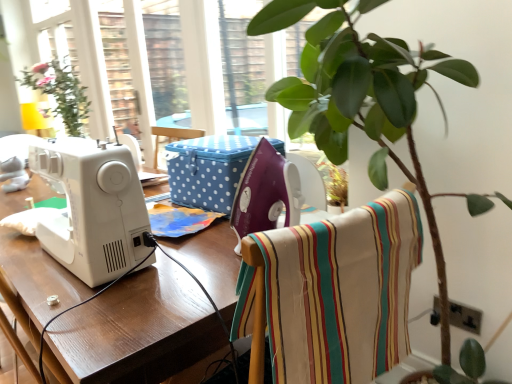
Question: Does white glossy sewing machine at left contain blue polka dot fabric box at center?

Choices:
 (A) no
 (B) yes

Answer: (A)

Question: Is white glossy sewing machine at left wider than blue polka dot fabric box at center?

Choices:
 (A) no
 (B) yes

Answer: (B)

Question: Does white glossy sewing machine at left appear on the left side of blue polka dot fabric box at center?

Choices:
 (A) no
 (B) yes

Answer: (B)

Question: From a real-world perspective, does white glossy sewing machine at left stand above blue polka dot fabric box at center?

Choices:
 (A) yes
 (B) no

Answer: (B)

Question: From the image's perspective, would you say white glossy sewing machine at left is shown under blue polka dot fabric box at center?

Choices:
 (A) no
 (B) yes

Answer: (B)

Question: From a real-world perspective, is white glossy sewing machine at left positioned above or below white plastic sewing machine at center, placed as the first sewing machine when sorted from right to left?

Choices:
 (A) below
 (B) above

Answer: (A)

Question: Is white glossy sewing machine at left taller or shorter than white plastic sewing machine at center, placed as the first sewing machine when sorted from right to left?

Choices:
 (A) tall
 (B) short

Answer: (A)

Question: Based on their sizes in the image, would you say white glossy sewing machine at left is bigger or smaller than white plastic sewing machine at center, placed as the first sewing machine when sorted from right to left?

Choices:
 (A) big
 (B) small

Answer: (A)

Question: From the image's perspective, is white glossy sewing machine at left above or below white plastic sewing machine at center, placed as the first sewing machine when sorted from right to left?

Choices:
 (A) below
 (B) above

Answer: (A)

Question: Considering the positions of striped cotton fabric at center and white glossy sewing machine at left in the image, is striped cotton fabric at center taller or shorter than white glossy sewing machine at left?

Choices:
 (A) short
 (B) tall

Answer: (A)

Question: Based on their positions, is striped cotton fabric at center located to the left or right of white glossy sewing machine at left?

Choices:
 (A) left
 (B) right

Answer: (B)

Question: Considering the positions of point coord(303,326) and point coord(4,241), is point coord(303,326) closer or farther from the camera than point coord(4,241)?

Choices:
 (A) farther
 (B) closer

Answer: (B)

Question: From a real-world perspective, is striped cotton fabric at center above or below white glossy sewing machine at left?

Choices:
 (A) below
 (B) above

Answer: (B)

Question: From a real-world perspective, is white plastic sewing machine at left, the second sewing machine viewed from the right, positioned above or below striped cotton fabric at center?

Choices:
 (A) above
 (B) below

Answer: (A)

Question: From the image's perspective, is white plastic sewing machine at left, the second sewing machine viewed from the right, above or below striped cotton fabric at center?

Choices:
 (A) below
 (B) above

Answer: (B)